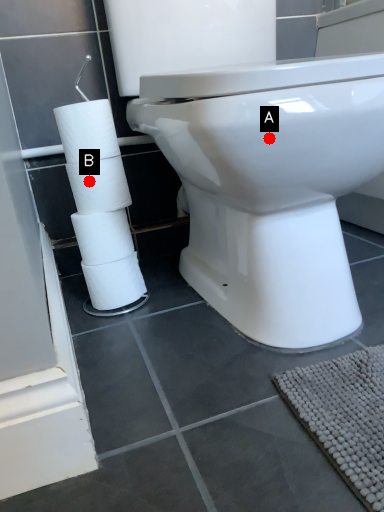
Question: Two points are circled on the image, labeled by A and B beside each circle. Which point is farther to the camera?

Choices:
 (A) A is further
 (B) B is further

Answer: (B)